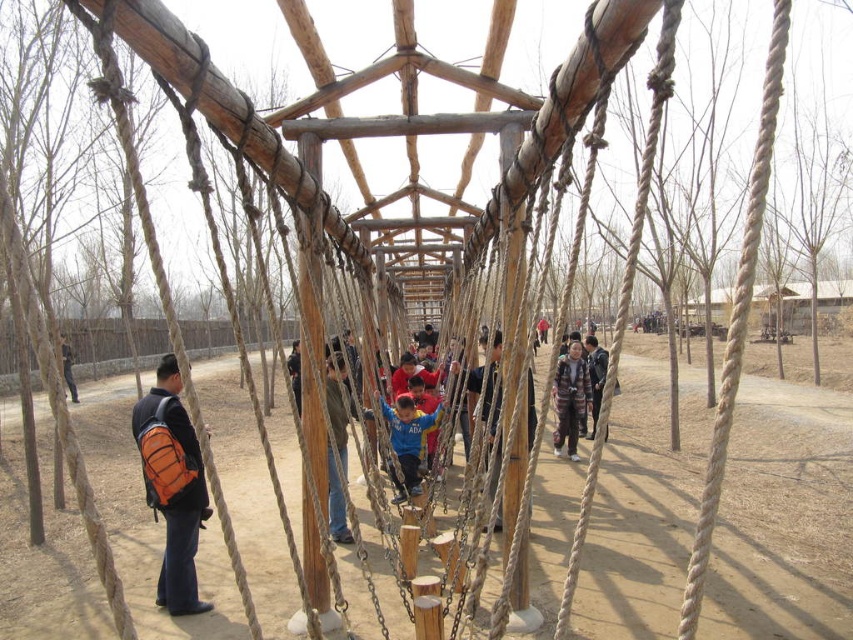
Question: Does orange fabric backpack at left appear under blue matte shirt at center?

Choices:
 (A) yes
 (B) no

Answer: (B)

Question: Which point is closer to the camera taking this photo?

Choices:
 (A) (566, 381)
 (B) (595, 412)

Answer: (A)

Question: Can you confirm if blue matte shirt at center is positioned above camouflage jacket at center?

Choices:
 (A) no
 (B) yes

Answer: (A)

Question: Which point appears closest to the camera in this image?

Choices:
 (A) pyautogui.click(x=393, y=451)
 (B) pyautogui.click(x=573, y=369)
 (C) pyautogui.click(x=62, y=364)
 (D) pyautogui.click(x=596, y=355)

Answer: (A)

Question: Does striped fabric jacket at center lie in front of orange backpack at left?

Choices:
 (A) no
 (B) yes

Answer: (B)

Question: Among these objects, which one is farthest from the camera?

Choices:
 (A) blue matte shirt at center
 (B) orange backpack at left
 (C) striped fabric jacket at center

Answer: (B)